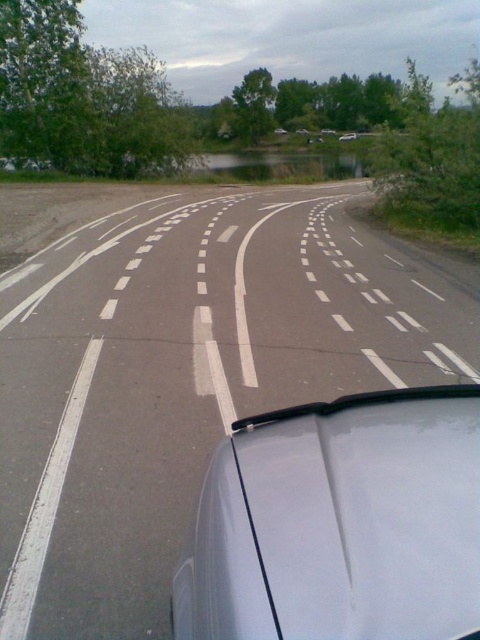
You are driving a car and need to make a quick U turn in the white asphalt road at center. Considering the width of the satin white car at center, do you think it is possible to perform a U turn without crossing the road edges?

The white asphalt road at center might be wider than the satin white car at center, so it is possible to make a U turn without crossing the road edges as long as the driver stays within the road width.

You are driving a car and looking at the road ahead. There are two points marked on the road at coordinates point [227,228] and point [447,410]. Which point is closer to your car?

Point [227,228] is closer to your car because it is further to the viewer than point [447,410].

You are driving a white glossy car at center and want to check if your car is positioned correctly on the white asphalt road at center. Based on the scene, is your car entirely on the road?

The white asphalt road at center is below the white glossy car at center, so the car is positioned on the road.